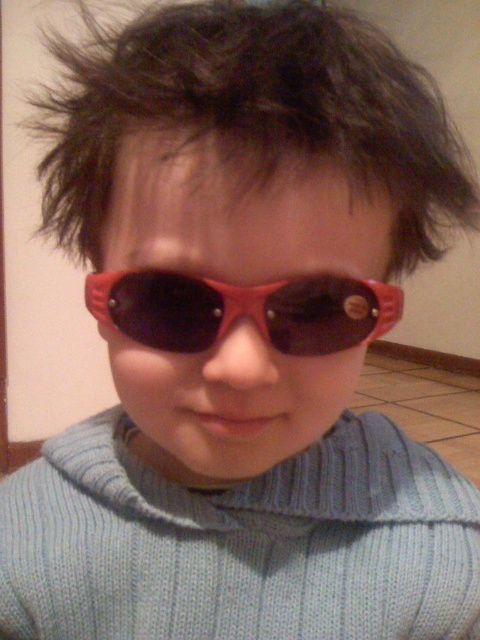
Question: Which point appears farthest from the camera in this image?

Choices:
 (A) (245, 292)
 (B) (389, 134)

Answer: (A)

Question: Where is dark brown spiky hair at upper center located in relation to rubberized red goggles at center in the image?

Choices:
 (A) left
 (B) right

Answer: (B)

Question: Which point is closer to the camera?

Choices:
 (A) (452, 224)
 (B) (156, 346)

Answer: (B)

Question: Is dark brown spiky hair at upper center to the left of rubberized red goggles at center from the viewer's perspective?

Choices:
 (A) no
 (B) yes

Answer: (A)

Question: Which point is closer to the camera?

Choices:
 (A) dark brown spiky hair at upper center
 (B) rubberized red goggles at center

Answer: (A)

Question: Is dark brown spiky hair at upper center closer to camera compared to rubberized red goggles at center?

Choices:
 (A) no
 (B) yes

Answer: (B)